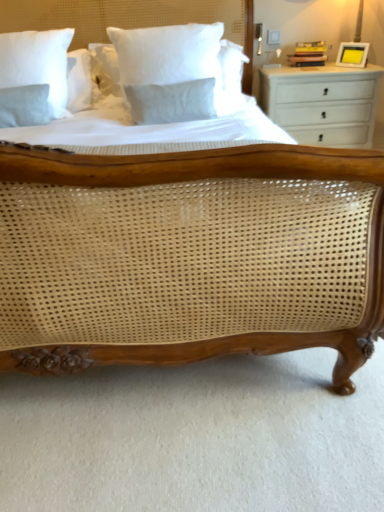
Question: Considering their positions, is white cotton pillow at upper center, the first pillow when ordered from front to back, located in front of or behind white painted wood chest of drawers at right?

Choices:
 (A) behind
 (B) front

Answer: (B)

Question: Is white cotton pillow at upper center, arranged as the 2th pillow when viewed from the left, wider or thinner than white painted wood chest of drawers at right?

Choices:
 (A) thin
 (B) wide

Answer: (A)

Question: Estimate the real-world distances between objects in this image. Which object is closer to the yellow matte picture frame at upper right?

Choices:
 (A) white painted wood chest of drawers at right
 (B) white cotton pillow at upper left, acting as the first pillow starting from the left
 (C) white cotton pillow at upper center, acting as the second pillow starting from the back

Answer: (A)

Question: Which of these objects is positioned farthest from the white painted wood chest of drawers at right?

Choices:
 (A) white cotton pillow at upper center, arranged as the 2th pillow when viewed from the left
 (B) white cotton pillow at upper left, acting as the first pillow starting from the back
 (C) yellow matte picture frame at upper right

Answer: (B)